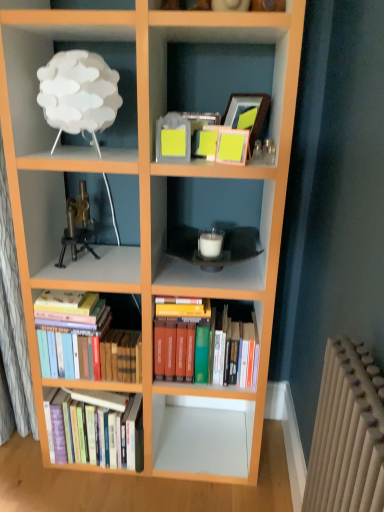
I want to click on free region on the left part of hardcover books at lower left, the first book positioned from the left, so click(x=24, y=469).